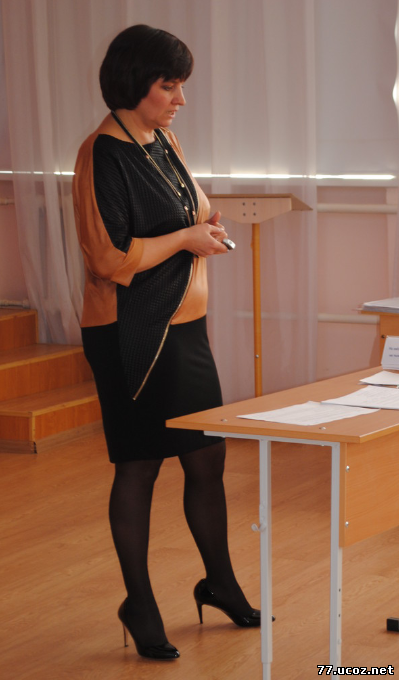
Locate an element on the screen. wood floor is located at coordinates (80, 532).